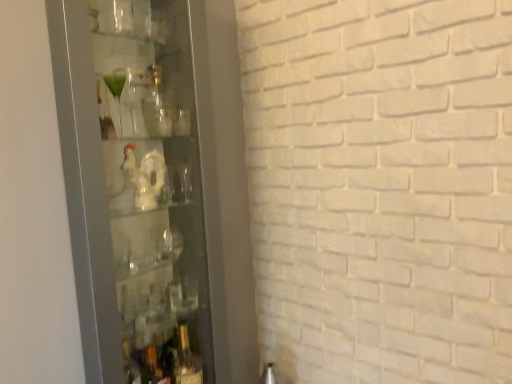
Question: Considering the relative sizes of translucent glass bottle at lower center and transparent glass cabinet at left in the image provided, is translucent glass bottle at lower center bigger than transparent glass cabinet at left?

Choices:
 (A) no
 (B) yes

Answer: (A)

Question: From the image's perspective, is translucent glass bottle at lower center under transparent glass cabinet at left?

Choices:
 (A) yes
 (B) no

Answer: (A)

Question: Is translucent glass bottle at lower center smaller than transparent glass cabinet at left?

Choices:
 (A) no
 (B) yes

Answer: (B)

Question: Is translucent glass bottle at lower center not near transparent glass cabinet at left?

Choices:
 (A) no
 (B) yes

Answer: (A)

Question: From the image's perspective, is translucent glass bottle at lower center over transparent glass cabinet at left?

Choices:
 (A) yes
 (B) no

Answer: (B)

Question: Does translucent glass bottle at lower center appear on the left side of transparent glass cabinet at left?

Choices:
 (A) yes
 (B) no

Answer: (B)

Question: Is transparent glass cabinet at left oriented away from translucent glass bottle at lower center?

Choices:
 (A) yes
 (B) no

Answer: (A)

Question: Is transparent glass cabinet at left oriented towards translucent glass bottle at lower center?

Choices:
 (A) no
 (B) yes

Answer: (B)

Question: Is the depth of transparent glass cabinet at left less than that of translucent glass bottle at lower center?

Choices:
 (A) no
 (B) yes

Answer: (B)

Question: Is translucent glass bottle at lower center located within transparent glass cabinet at left?

Choices:
 (A) no
 (B) yes

Answer: (B)

Question: Considering the relative sizes of transparent glass cabinet at left and translucent glass bottle at lower center in the image provided, is transparent glass cabinet at left wider than translucent glass bottle at lower center?

Choices:
 (A) yes
 (B) no

Answer: (A)

Question: Is the depth of transparent glass cabinet at left greater than that of translucent glass bottle at lower center?

Choices:
 (A) no
 (B) yes

Answer: (A)

Question: From the image's perspective, is transparent glass cabinet at left located above or below translucent glass bottle at lower center?

Choices:
 (A) above
 (B) below

Answer: (A)